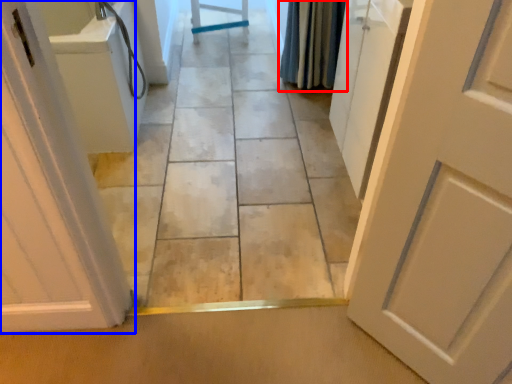
Question: Which point is closer to the camera, shower curtain (highlighted by a red box) or door (highlighted by a blue box)?

Choices:
 (A) shower curtain
 (B) door

Answer: (B)